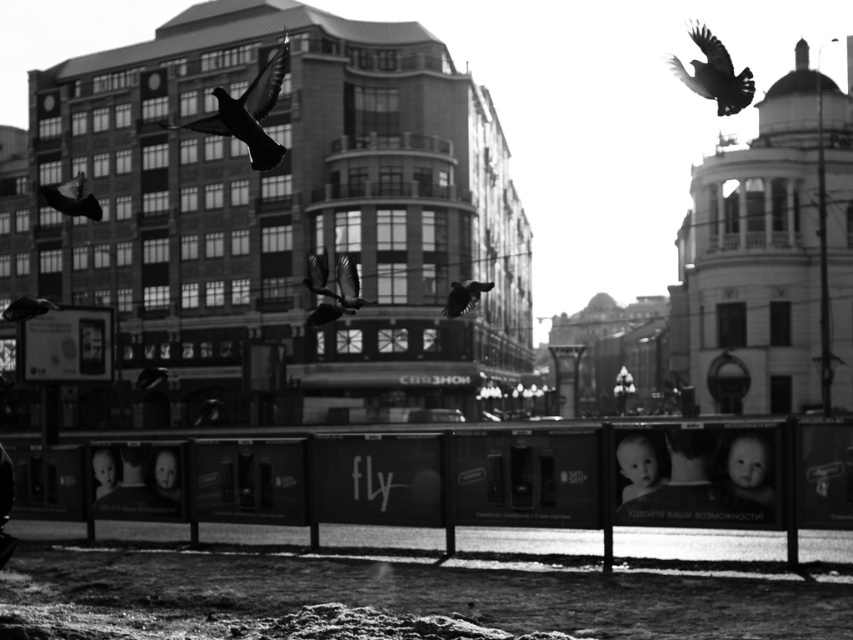
Question: Is shiny black bird at center above silvery metallic bird at center?

Choices:
 (A) no
 (B) yes

Answer: (B)

Question: Estimate the real-world distances between objects in this image. Which object is closer to the silhouette feathered bird at center?

Choices:
 (A) silvery metallic bird at center
 (B) shiny black bird at center
 (C) matte black bird at left
 (D) dark feathered bird at upper center

Answer: (D)

Question: Which point is closer to the camera?

Choices:
 (A) (30, 301)
 (B) (56, 200)

Answer: (B)

Question: Can you confirm if dark feathered bird at upper center is positioned to the left of black matte bird at upper right?

Choices:
 (A) no
 (B) yes

Answer: (B)

Question: Does dark feathered bird at upper center appear over shiny black bird at center?

Choices:
 (A) no
 (B) yes

Answer: (B)

Question: Among these objects, which one is farthest from the camera?

Choices:
 (A) silvery metallic bird at center
 (B) black matte bird at upper right

Answer: (A)